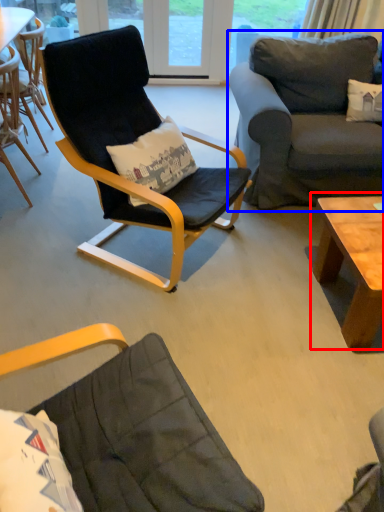
Question: Which object is closer to the camera taking this photo, coffee table (highlighted by a red box) or studio couch (highlighted by a blue box)?

Choices:
 (A) coffee table
 (B) studio couch

Answer: (A)